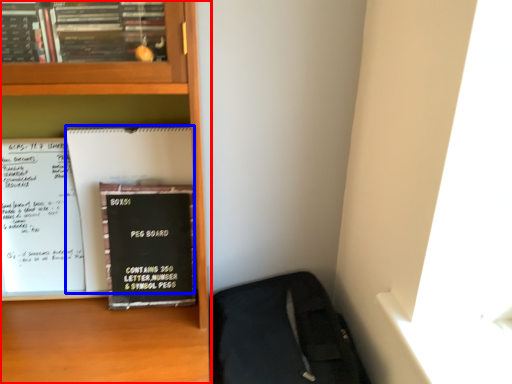
Question: Which object is further to the camera taking this photo, bookcase (highlighted by a red box) or paperback book (highlighted by a blue box)?

Choices:
 (A) bookcase
 (B) paperback book

Answer: (B)